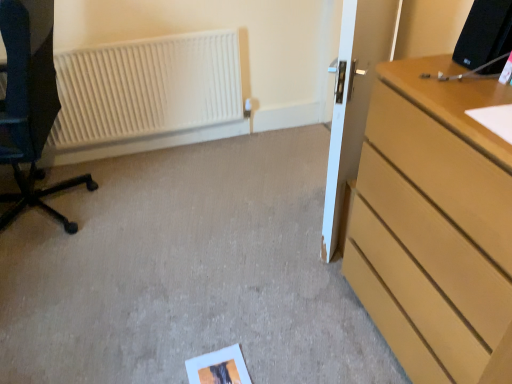
Question: Is white matte radiator at upper left behind matte black chair at left?

Choices:
 (A) yes
 (B) no

Answer: (A)

Question: Does white matte radiator at upper left have a smaller size compared to matte black chair at left?

Choices:
 (A) yes
 (B) no

Answer: (A)

Question: Is white matte radiator at upper left beside matte black chair at left?

Choices:
 (A) yes
 (B) no

Answer: (B)

Question: Considering the relative sizes of white matte radiator at upper left and matte black chair at left in the image provided, is white matte radiator at upper left shorter than matte black chair at left?

Choices:
 (A) no
 (B) yes

Answer: (B)

Question: Can you confirm if white matte radiator at upper left is positioned to the right of matte black chair at left?

Choices:
 (A) yes
 (B) no

Answer: (A)

Question: From a real-world perspective, is white matte radiator at upper left on matte black chair at left?

Choices:
 (A) yes
 (B) no

Answer: (B)

Question: Does matte black chair at left contain white matte radiator at upper left?

Choices:
 (A) yes
 (B) no

Answer: (B)

Question: Can you confirm if matte black chair at left is bigger than white matte radiator at upper left?

Choices:
 (A) no
 (B) yes

Answer: (B)

Question: From the image's perspective, is matte black chair at left located beneath white matte radiator at upper left?

Choices:
 (A) no
 (B) yes

Answer: (B)

Question: Is matte black chair at left facing towards white matte radiator at upper left?

Choices:
 (A) yes
 (B) no

Answer: (B)

Question: From the image's perspective, is matte black chair at left located above white matte radiator at upper left?

Choices:
 (A) no
 (B) yes

Answer: (A)

Question: Does matte black chair at left appear on the left side of white matte radiator at upper left?

Choices:
 (A) no
 (B) yes

Answer: (B)

Question: Is white glossy door at center wider than white matte radiator at upper left?

Choices:
 (A) yes
 (B) no

Answer: (A)